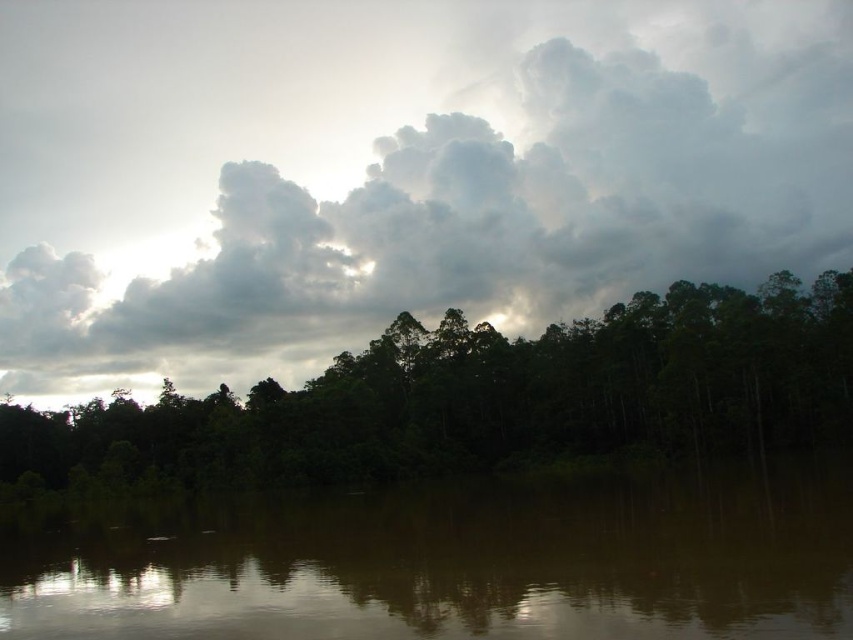
You are an artist planning to paint this scene. You want to ensure that the cloudy sky at upper center and the brown reflective water at center are proportionally accurate. Which object should you make larger in your painting?

The cloudy sky at upper center should be made larger than the brown reflective water at center in the painting since it is larger in size according to the description.

You are standing in the serene natural scene and want to place a small boat between the two points, point [190,340] and point [776,273]. Since the boat requires a clear path, will the boat be able to navigate between these two points without any obstructions?

The point [190,340] is closer to you than point [776,273]. Therefore, the boat can navigate between them as there are no obstructions mentioned in the scene description, and the water is calm with subtle ripples.